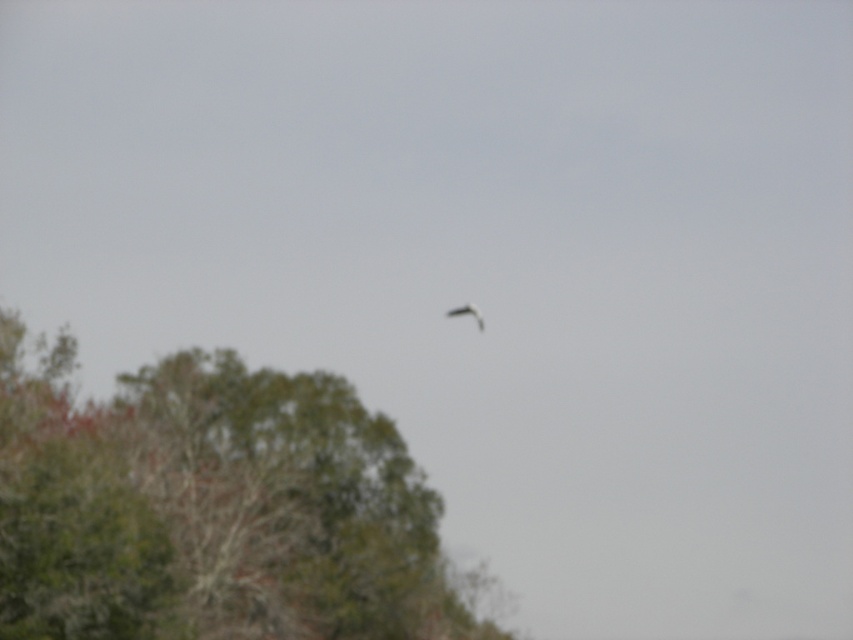
Question: Is green leafy tree at lower left closer to the viewer compared to smooth gray bird at center?

Choices:
 (A) yes
 (B) no

Answer: (A)

Question: Observing the image, what is the correct spatial positioning of green leafy tree at lower left in reference to smooth gray bird at center?

Choices:
 (A) right
 (B) left

Answer: (B)

Question: Is the position of green leafy tree at lower left less distant than that of smooth gray bird at center?

Choices:
 (A) yes
 (B) no

Answer: (A)

Question: Which of the following is the farthest from the observer?

Choices:
 (A) (477, 324)
 (B) (248, 616)

Answer: (A)